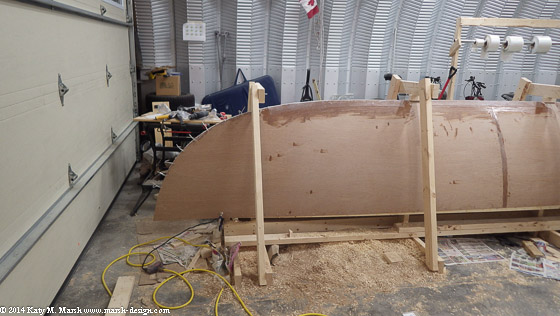
This screenshot has height=316, width=560. I want to click on garage floor, so [x=105, y=248].